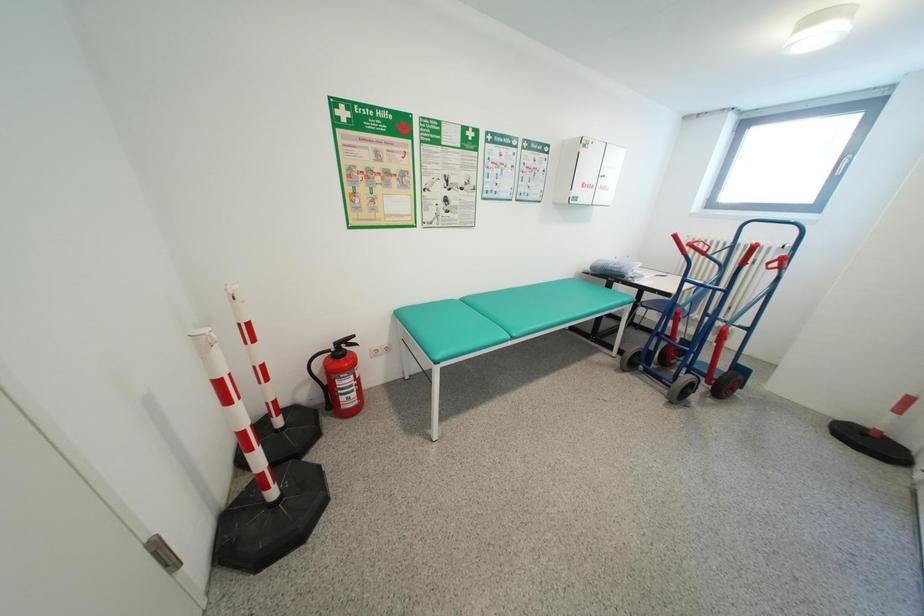
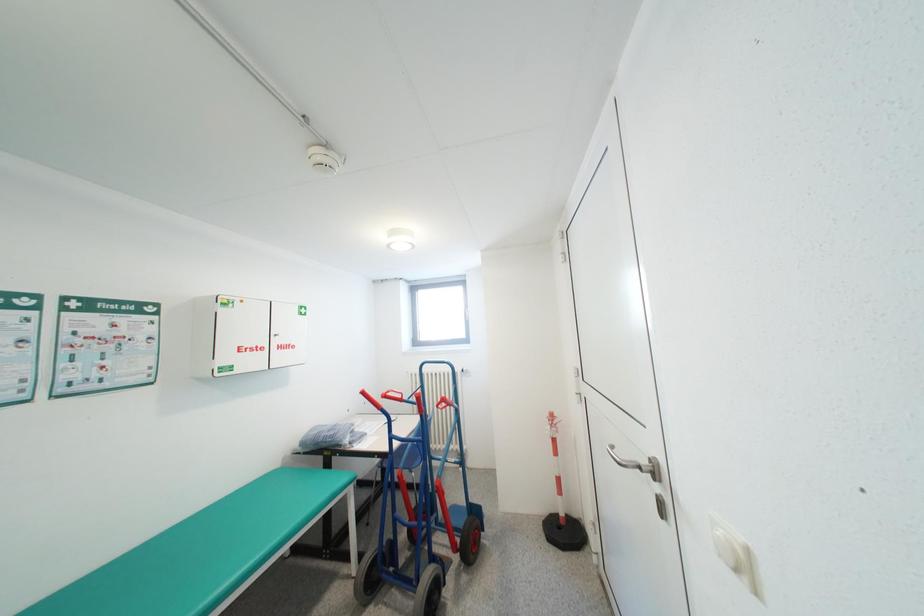
The images are taken continuously from a first-person perspective. In which direction is your viewpoint rotating?

The camera rotated toward right-up.